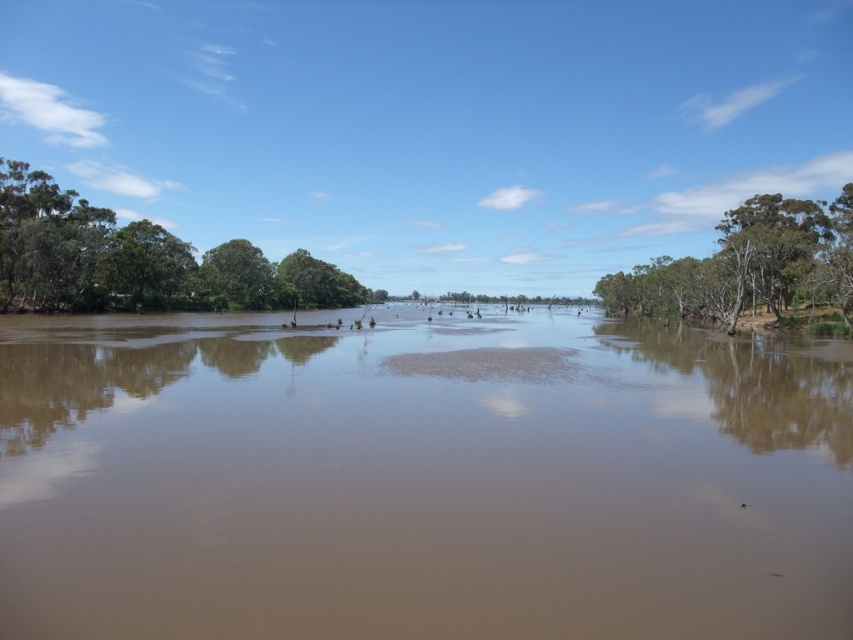
Identify the location of brown muddy water at center. Image resolution: width=853 pixels, height=640 pixels. (419, 477).

Is brown muddy water at center below green leafy trees at left?

Yes, brown muddy water at center is below green leafy trees at left.

Is point (10, 506) closer to viewer compared to point (260, 260)?

Yes, it is in front of point (260, 260).

Where is `brown muddy water at center`? brown muddy water at center is located at coordinates (419, 477).

This screenshot has height=640, width=853. What do you see at coordinates (419, 477) in the screenshot?
I see `brown muddy water at center` at bounding box center [419, 477].

Is brown muddy water at center taller than green leafy tree at right?

No.

You are a GUI agent. You are given a task and a screenshot of the screen. Output one action in this format:
    pyautogui.click(x=<x>, y=<y>)
    Task: Click on the brown muddy water at center
    
    Given the screenshot: What is the action you would take?
    pyautogui.click(x=419, y=477)

The width and height of the screenshot is (853, 640). In order to click on brown muddy water at center in this screenshot , I will do `click(419, 477)`.

Who is taller, green leafy trees at left or green leafy tree at right?

green leafy trees at left

Is green leafy trees at left smaller than green leafy tree at right?

Actually, green leafy trees at left might be larger than green leafy tree at right.

Does point (347, 292) lie in front of point (621, 285)?

No, it is behind (621, 285).

At what (x,y) coordinates should I click in order to perform the action: click on green leafy trees at left. Please return your answer as a coordinate pair (x, y). Looking at the image, I should click on pyautogui.click(x=137, y=260).